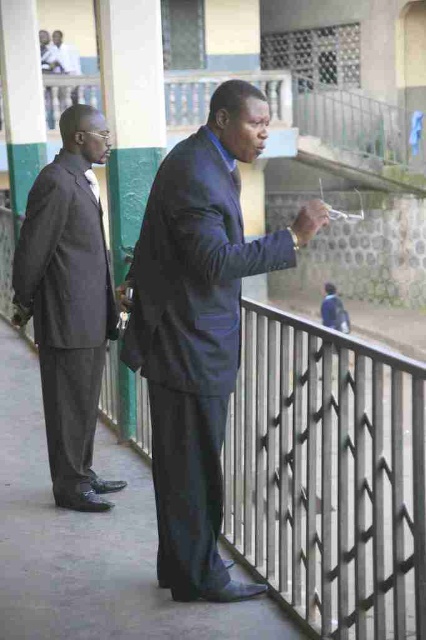
You are an event planner organizing a photoshoot and need to position two models wearing the matte black suit at center and the matte gray suit at left. Since you want to emphasize the size difference between them, which model should you place closer to the camera?

The matte black suit at center is bigger than the matte gray suit at left, so to emphasize the size difference, place the matte gray suit at left closer to the camera. This way, the smaller suit will appear larger in comparison, highlighting the contrast between their sizes.

You are a photographer trying to capture a clear shot of the matte black suit at center without the gray concrete pavement at center obstructing the background. Is the current positioning suitable for this?

Yes, the matte black suit at center is positioned in front of the gray concrete pavement at center, so the pavement will not obstruct the background in your shot as the suit is in front.